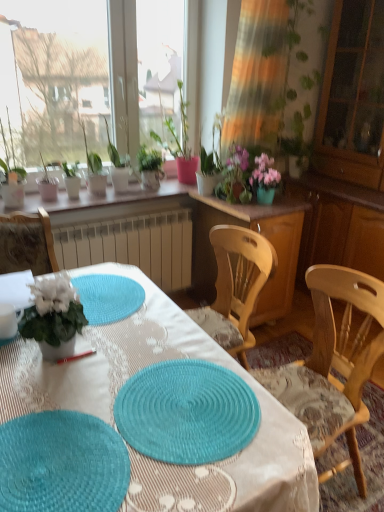
Where is `free space to the right of white matte plant at left, the 5th houseplant from the left`? The image size is (384, 512). free space to the right of white matte plant at left, the 5th houseplant from the left is located at coordinates (121, 348).